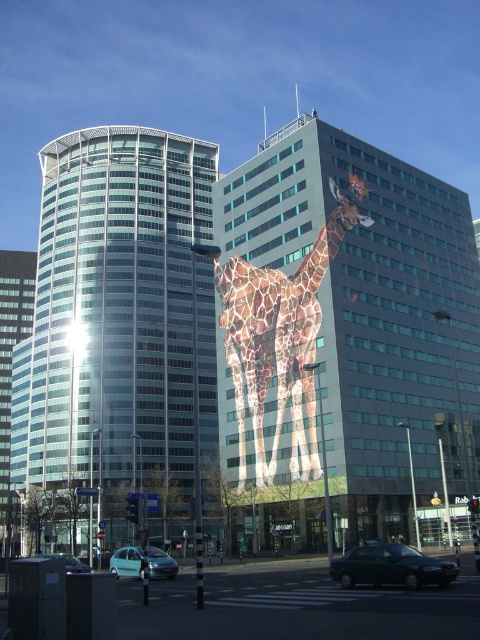
Is point (11, 545) positioned behind point (375, 576)?

Yes, point (11, 545) is farther from viewer.

Is glassy modern skyscraper at left in front of metallic dark green car at lower center?

No, glassy modern skyscraper at left is further to the viewer.

Which is in front, point (6, 256) or point (389, 556)?

Positioned in front is point (389, 556).

This screenshot has width=480, height=640. Identify the location of glassy modern skyscraper at left. (11, 372).

Who is taller, glassy silver tower at center or spotted fur giraffe at center?

glassy silver tower at center is taller.

Is glassy silver tower at center bigger than spotted fur giraffe at center?

Indeed, glassy silver tower at center has a larger size compared to spotted fur giraffe at center.

Does point (60, 531) come in front of point (361, 188)?

No, it is behind (361, 188).

At what (x,y) coordinates should I click in order to perform the action: click on glassy silver tower at center. Please return your answer as a coordinate pair (x, y). This screenshot has height=640, width=480. Looking at the image, I should click on (109, 337).

Is point (311, 369) less distant than point (151, 564)?

No, (311, 369) is further to viewer.

Does spotted fur giraffe at center come in front of light blue matte car at lower left?

No, it is behind light blue matte car at lower left.

Where is `spotted fur giraffe at center`? This screenshot has height=640, width=480. spotted fur giraffe at center is located at coordinates (304, 330).